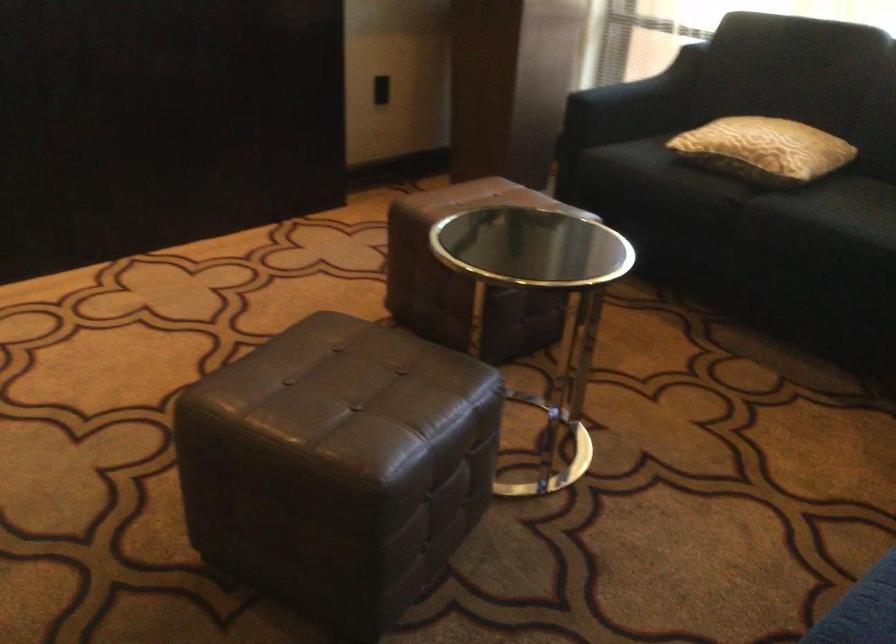
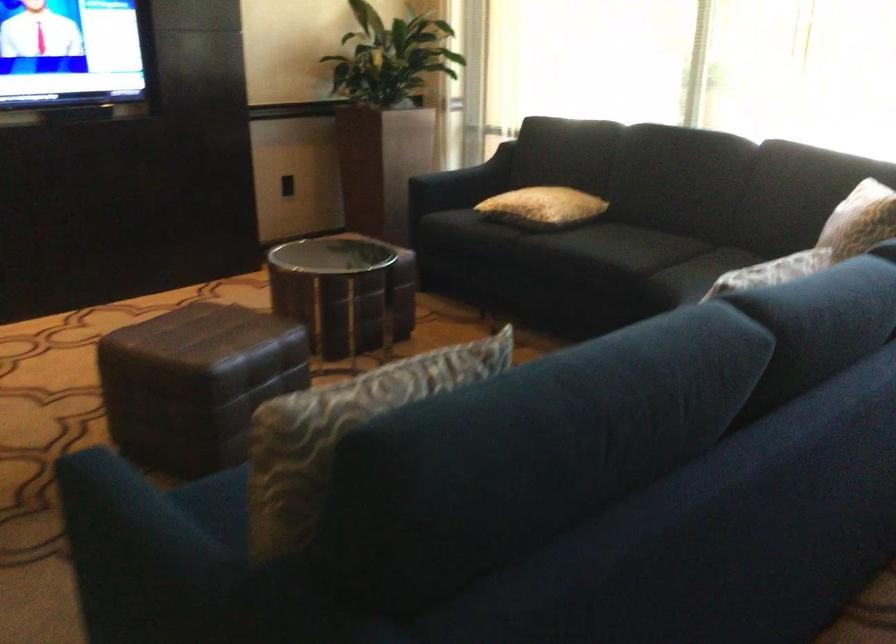
In the second image, find the point that corresponds to (354,498) in the first image.

(195, 383)